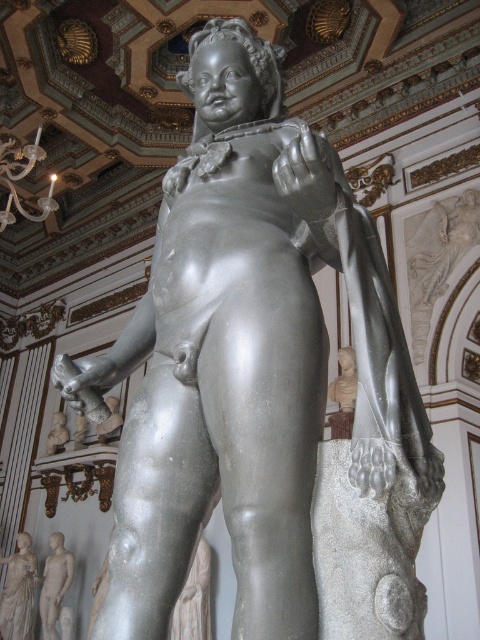
Describe the element at coordinates (19, 592) in the screenshot. I see `smooth white statue at lower left` at that location.

Who is positioned more to the right, smooth white statue at lower left or gray marble statue at lower left?

gray marble statue at lower left is more to the right.

Is point (15, 632) behind point (54, 566)?

No, (15, 632) is in front of (54, 566).

Identify the location of smooth white statue at lower left. (19, 592).